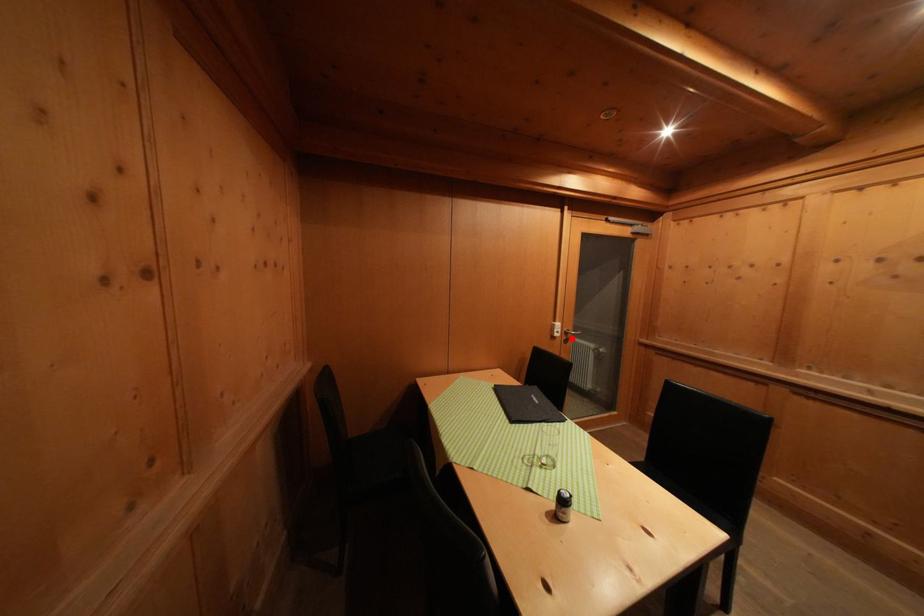
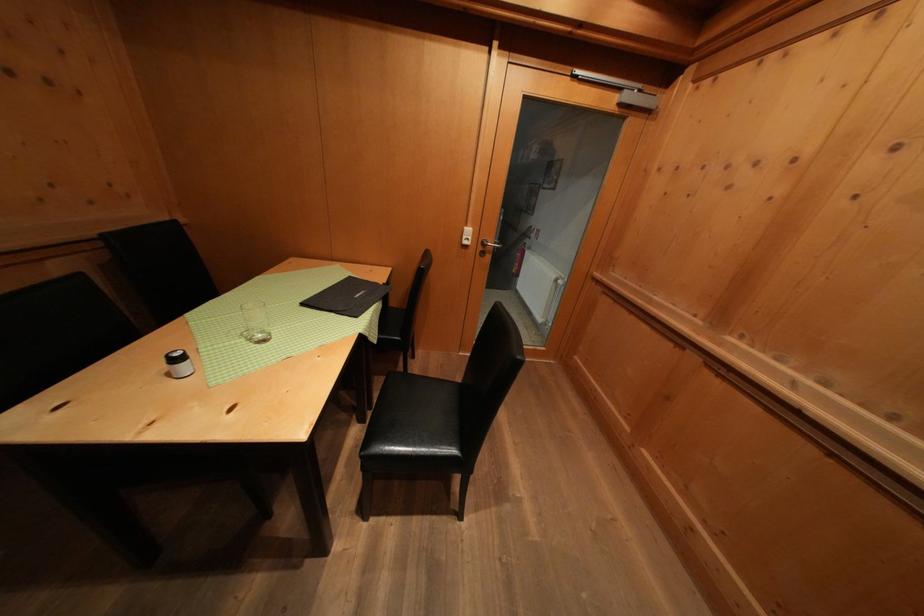
Question: I am providing you with two images of the same scene from different viewpoints. In image1, a red point is highlighted. Considering the same 3D point in image2, which of the following is correct?

Choices:
 (A) It is closer
 (B) It is farther

Answer: (A)